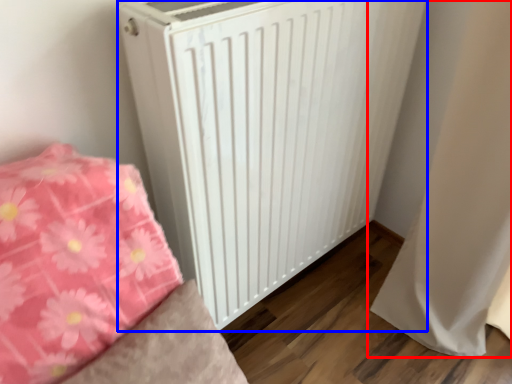
Question: Which of the following is the closest to the observer, curtain (highlighted by a red box) or radiator (highlighted by a blue box)?

Choices:
 (A) curtain
 (B) radiator

Answer: (B)